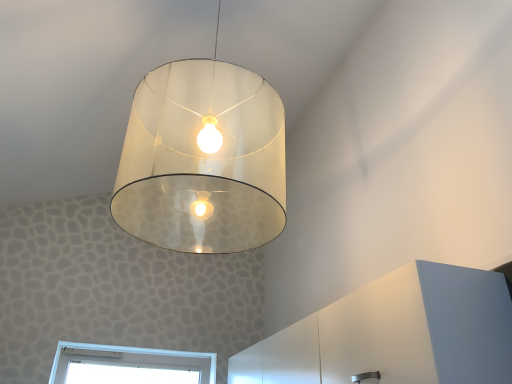
Question: Is translucent glass lampshade at center positioned with its back to white matte dresser at lower right?

Choices:
 (A) yes
 (B) no

Answer: (B)

Question: Are translucent glass lampshade at center and white matte dresser at lower right located far from each other?

Choices:
 (A) no
 (B) yes

Answer: (A)

Question: From a real-world perspective, is translucent glass lampshade at center below white matte dresser at lower right?

Choices:
 (A) yes
 (B) no

Answer: (B)

Question: Can you confirm if translucent glass lampshade at center is bigger than white matte dresser at lower right?

Choices:
 (A) no
 (B) yes

Answer: (B)

Question: Is the depth of translucent glass lampshade at center greater than that of white matte dresser at lower right?

Choices:
 (A) no
 (B) yes

Answer: (A)

Question: Is translucent glass lampshade at center oriented towards white matte dresser at lower right?

Choices:
 (A) yes
 (B) no

Answer: (B)

Question: Is white matte dresser at lower right behind translucent glass lampshade at center?

Choices:
 (A) yes
 (B) no

Answer: (A)

Question: From a real-world perspective, is white matte dresser at lower right beneath translucent glass lampshade at center?

Choices:
 (A) yes
 (B) no

Answer: (A)

Question: Could you tell me if white matte dresser at lower right is turned towards translucent glass lampshade at center?

Choices:
 (A) yes
 (B) no

Answer: (B)

Question: Is white matte dresser at lower right outside translucent glass lampshade at center?

Choices:
 (A) no
 (B) yes

Answer: (B)

Question: Would you say white matte dresser at lower right contains translucent glass lampshade at center?

Choices:
 (A) no
 (B) yes

Answer: (A)

Question: Considering the relative sizes of white matte dresser at lower right and translucent glass lampshade at center in the image provided, is white matte dresser at lower right wider than translucent glass lampshade at center?

Choices:
 (A) no
 (B) yes

Answer: (A)

Question: In terms of height, does white matte dresser at lower right look taller or shorter compared to translucent glass lampshade at center?

Choices:
 (A) tall
 (B) short

Answer: (B)